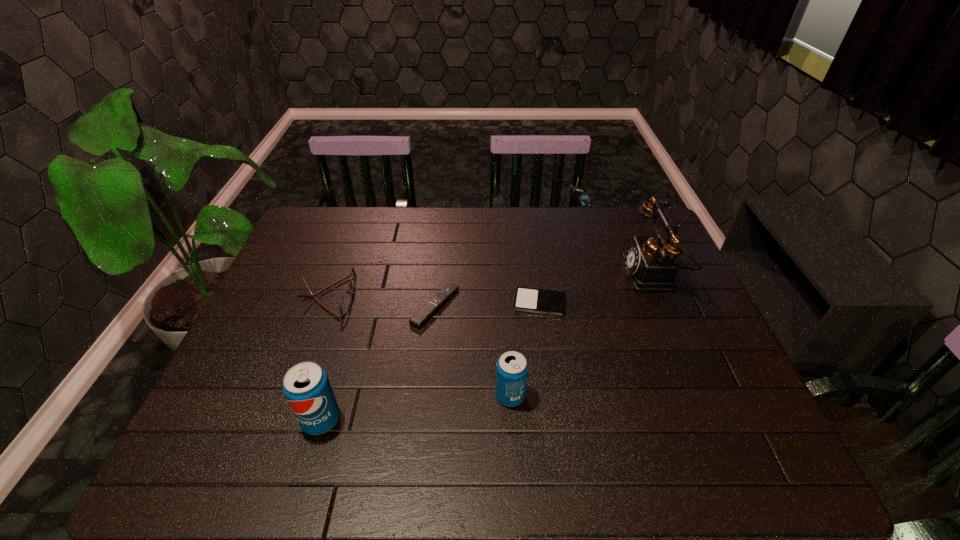
Identify the location of vacant space located on the left of the taller soda can. Image resolution: width=960 pixels, height=540 pixels. (238, 420).

Where is `free space located 0.120m on the left of the shorter soda can`? free space located 0.120m on the left of the shorter soda can is located at coordinates (444, 396).

You are a GUI agent. You are given a task and a screenshot of the screen. Output one action in this format:
    pyautogui.click(x=<x>, y=<y>)
    Task: Click on the free region located 0.170m on the front-facing side of the spectacles
    
    Given the screenshot: What is the action you would take?
    pyautogui.click(x=415, y=296)

Identify the location of free space located on the right of the iPod. (698, 303).

Identify the location of free space located on the front of the rightmost object at the rotary dial. The width and height of the screenshot is (960, 540). (525, 275).

Identify the location of blank space located on the front of the rightmost object at the rotary dial. The image size is (960, 540). (575, 275).

Where is `vacant space located 0.280m on the front of the rightmost object at the rotary dial`? vacant space located 0.280m on the front of the rightmost object at the rotary dial is located at coordinates (532, 275).

Locate an element on the screen. free spot located 0.320m on the right of the fourth object from right to left is located at coordinates (573, 306).

Find the location of a particular element. object that is at the far edge is located at coordinates (650, 262).

Locate an element on the screen. The height and width of the screenshot is (540, 960). object that is at the left edge is located at coordinates (346, 299).